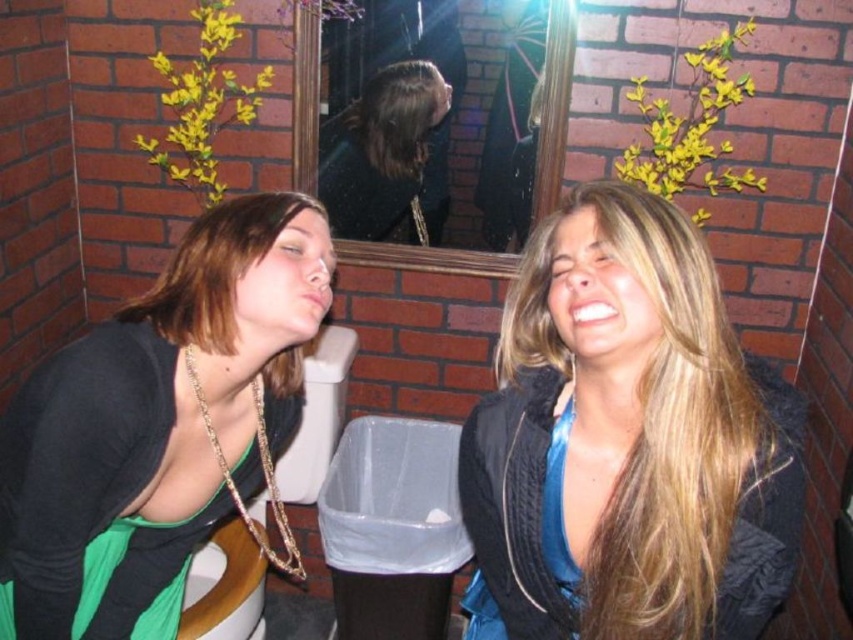
Between point (680, 604) and point (430, 182), which one is positioned behind?

The point (430, 182) is behind.

Who is more forward, (576,444) or (439,182)?

Positioned in front is point (576,444).

At what (x,y) coordinates should I click in order to perform the action: click on blue satin blouse at center. Please return your answer as a coordinate pair (x, y). The image size is (853, 640). Looking at the image, I should click on (627, 442).

Is point (213, 406) behind point (357, 184)?

No.

Is point (103, 468) positioned before point (416, 106)?

That is True.

Does point (86, 547) lie in front of point (325, 124)?

Yes, point (86, 547) is closer to viewer.

You are a GUI agent. You are given a task and a screenshot of the screen. Output one action in this format:
    pyautogui.click(x=<x>, y=<y>)
    Task: Click on the green fabric top at left
    Image resolution: width=853 pixels, height=640 pixels.
    Given the screenshot: What is the action you would take?
    pyautogui.click(x=158, y=426)

Does blue satin blouse at center appear over green fabric top at left?

No, blue satin blouse at center is not above green fabric top at left.

Is point (654, 611) more distant than point (42, 428)?

That is False.

The image size is (853, 640). What do you see at coordinates (627, 442) in the screenshot?
I see `blue satin blouse at center` at bounding box center [627, 442].

Identify the location of blue satin blouse at center. This screenshot has height=640, width=853. (627, 442).